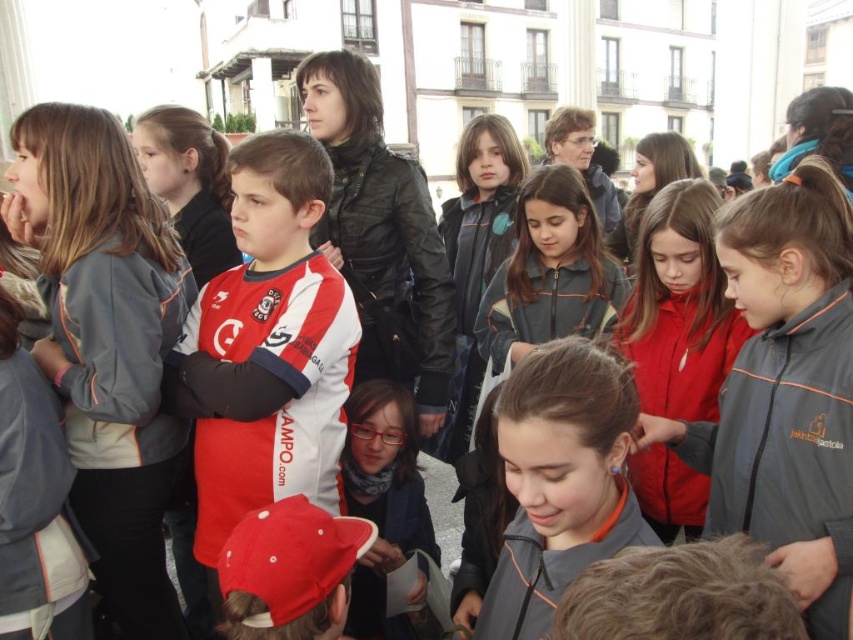
Does gray fleece jacket at left appear on the right side of gray matte jacket at center?

Incorrect, gray fleece jacket at left is not on the right side of gray matte jacket at center.

Who is higher up, gray fleece jacket at left or gray matte jacket at center?

gray fleece jacket at left is higher up.

Describe the element at coordinates (107, 342) in the screenshot. This screenshot has width=853, height=640. I see `gray fleece jacket at left` at that location.

Find the location of `gray fleece jacket at left`. gray fleece jacket at left is located at coordinates (107, 342).

Who is positioned more to the right, gray fleece jacket at left or red and white jersey at center?

red and white jersey at center is more to the right.

Which is in front, point (144, 396) or point (316, 336)?

Point (144, 396)

At what (x,y) coordinates should I click in order to perform the action: click on gray fleece jacket at left. Please return your answer as a coordinate pair (x, y). Looking at the image, I should click on (107, 342).

The width and height of the screenshot is (853, 640). In order to click on gray fleece jacket at left in this screenshot , I will do `click(107, 342)`.

From the picture: Between gray fleece jacket at left and gray fabric jacket at center, which one has less height?

gray fabric jacket at center

Which is more to the right, gray fleece jacket at left or gray fabric jacket at center?

gray fabric jacket at center

Is point (109, 602) farther from viewer compared to point (717, 234)?

No, it is in front of (717, 234).

Where is `gray fleece jacket at left`? Image resolution: width=853 pixels, height=640 pixels. gray fleece jacket at left is located at coordinates (107, 342).